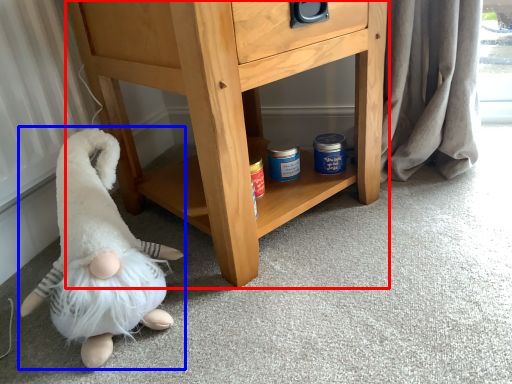
Question: Among these objects, which one is nearest to the camera, chest of drawers (highlighted by a red box) or toy (highlighted by a blue box)?

Choices:
 (A) chest of drawers
 (B) toy

Answer: (B)